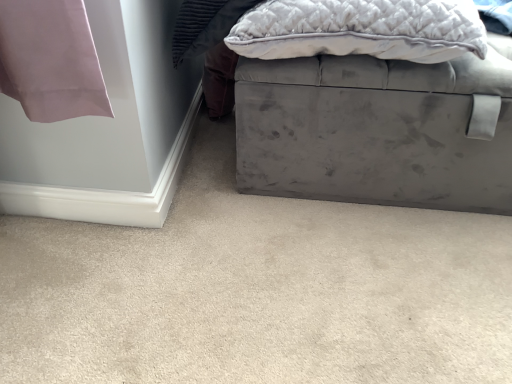
Question: Does velvet gray ottoman at lower right turn towards velvet gray pillow at upper right?

Choices:
 (A) yes
 (B) no

Answer: (B)

Question: From the image's perspective, is velvet gray ottoman at lower right above velvet gray pillow at upper right?

Choices:
 (A) yes
 (B) no

Answer: (B)

Question: Is velvet gray ottoman at lower right closer to camera compared to velvet gray pillow at upper right?

Choices:
 (A) no
 (B) yes

Answer: (B)

Question: Is velvet gray ottoman at lower right taller than velvet gray pillow at upper right?

Choices:
 (A) yes
 (B) no

Answer: (B)

Question: Considering the relative positions of velvet gray ottoman at lower right and velvet gray pillow at upper right in the image provided, is velvet gray ottoman at lower right behind velvet gray pillow at upper right?

Choices:
 (A) no
 (B) yes

Answer: (A)

Question: Is velvet gray ottoman at lower right bigger or smaller than velvet gray pillow at upper right?

Choices:
 (A) big
 (B) small

Answer: (A)

Question: From a real-world perspective, relative to velvet gray pillow at upper right, is velvet gray ottoman at lower right vertically above or below?

Choices:
 (A) above
 (B) below

Answer: (B)

Question: Looking at their shapes, would you say velvet gray ottoman at lower right is wider or thinner than velvet gray pillow at upper right?

Choices:
 (A) thin
 (B) wide

Answer: (B)

Question: Relative to velvet gray pillow at upper right, is velvet gray ottoman at lower right in front or behind?

Choices:
 (A) front
 (B) behind

Answer: (A)

Question: Looking at their shapes, would you say velvet gray pillow at upper right is wider or thinner than velvet gray ottoman at center?

Choices:
 (A) thin
 (B) wide

Answer: (A)

Question: In terms of size, does velvet gray pillow at upper right appear bigger or smaller than velvet gray ottoman at center?

Choices:
 (A) big
 (B) small

Answer: (B)

Question: In the image, is velvet gray pillow at upper right positioned in front of or behind velvet gray ottoman at center?

Choices:
 (A) front
 (B) behind

Answer: (A)

Question: Is point [x=290, y=21] positioned closer to the camera than point [x=431, y=77]?

Choices:
 (A) farther
 (B) closer

Answer: (B)

Question: Is velvet gray ottoman at center spatially inside velvet gray ottoman at lower right, or outside of it?

Choices:
 (A) outside
 (B) inside

Answer: (A)

Question: Relative to velvet gray ottoman at lower right, is velvet gray ottoman at center in front or behind?

Choices:
 (A) front
 (B) behind

Answer: (B)